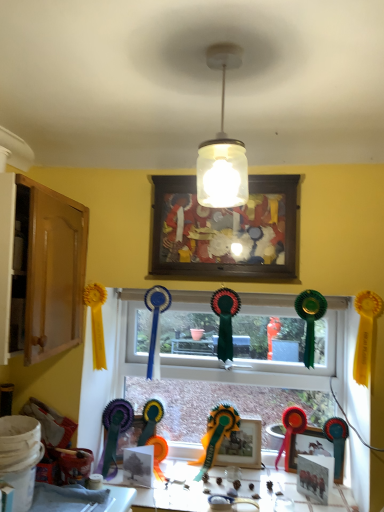
Image resolution: width=384 pixels, height=512 pixels. Identify the location of free space in front of shiny red ribbon at center, which is the 1th toy from right to left. pyautogui.click(x=288, y=483).